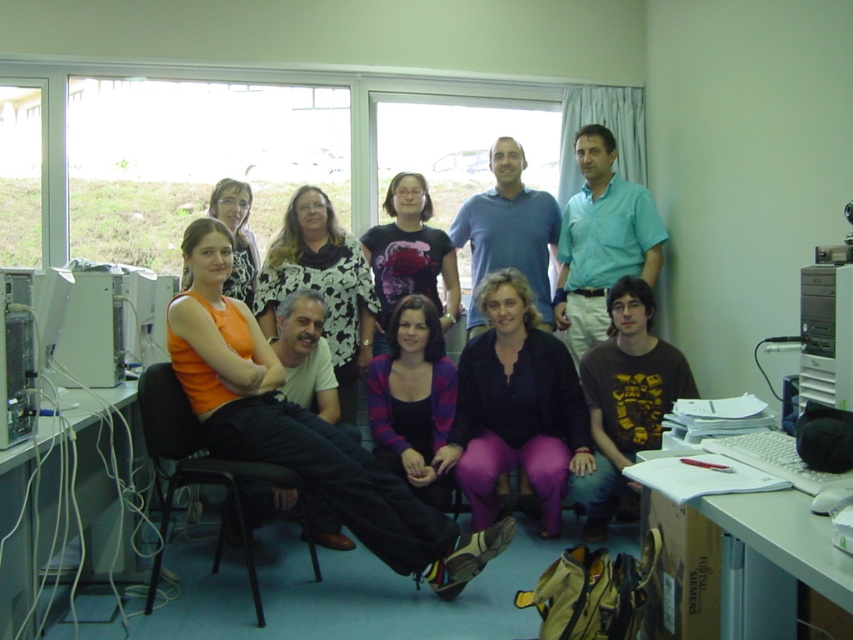
Which of these two, purple matte pants at center or striped sweater at center, stands taller?

purple matte pants at center is taller.

Image resolution: width=853 pixels, height=640 pixels. I want to click on purple matte pants at center, so click(515, 406).

I want to click on purple matte pants at center, so click(x=515, y=406).

Looking at this image, is orange matte tank top at center thinner than silver metallic tower at right?

In fact, orange matte tank top at center might be wider than silver metallic tower at right.

Between point (329, 486) and point (839, 364), which one is positioned in front?

Point (839, 364) is more forward.

You are a GUI agent. You are given a task and a screenshot of the screen. Output one action in this format:
    pyautogui.click(x=<x>, y=<y>)
    Task: Click on the orange matte tank top at center
    The height and width of the screenshot is (640, 853).
    Given the screenshot: What is the action you would take?
    pyautogui.click(x=300, y=428)

Looking at this image, is purple matte pants at center behind black metal chair at center?

Yes, it is behind black metal chair at center.

Where is `purple matte pants at center`? purple matte pants at center is located at coordinates (515, 406).